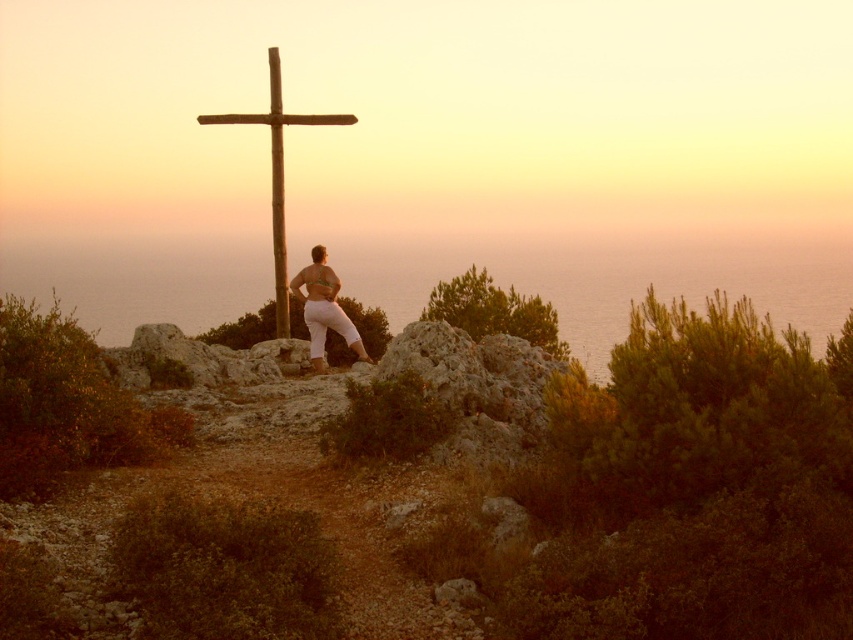
You are a hiker who has just arrived at this serene sunset scene. You notice a wooden cross at center and matte white pants at center. Which object is positioned higher relative to the other?

The wooden cross at center is above matte white pants at center, so it is positioned higher.

You are a photographer planning to capture the sunset scene. You notice the wooden cross at center and the matte white pants at center in the foreground. Which object should you focus on if you want to highlight the wider object in your composition?

The wooden cross at center is wider than the matte white pants at center, so focusing on the wooden cross at center would highlight the wider object in your composition.

You are standing at the edge of the rocky terrain in the foreground of the sunset scene. You notice two points marked on the ground. The first point is at coordinates point (277, 61), and the second point is at point (322, 285). Which of these two points is closer to your current position?

Point (277, 61) is further to the camera than point (322, 285). Therefore, the point closer to your current position is point (322, 285).